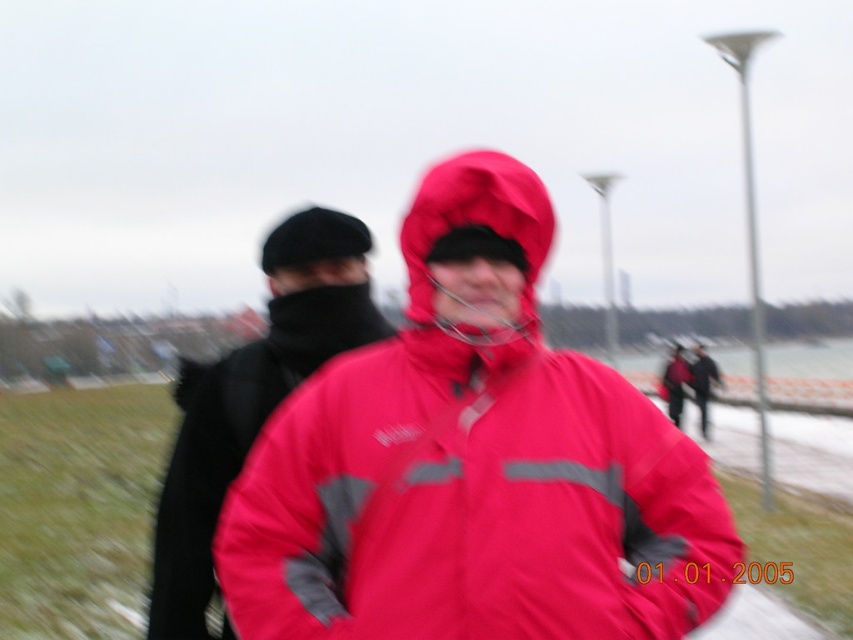
Question: From the image, what is the correct spatial relationship of matte pink jacket at center in relation to black matte jacket at left?

Choices:
 (A) right
 (B) left

Answer: (A)

Question: Can you confirm if matte pink jacket at center is bigger than black matte jacket at left?

Choices:
 (A) no
 (B) yes

Answer: (B)

Question: Which object appears farthest from the camera in this image?

Choices:
 (A) black matte jacket at left
 (B) matte pink jacket at center

Answer: (A)

Question: Can you confirm if matte pink jacket at center is wider than black matte jacket at left?

Choices:
 (A) no
 (B) yes

Answer: (B)